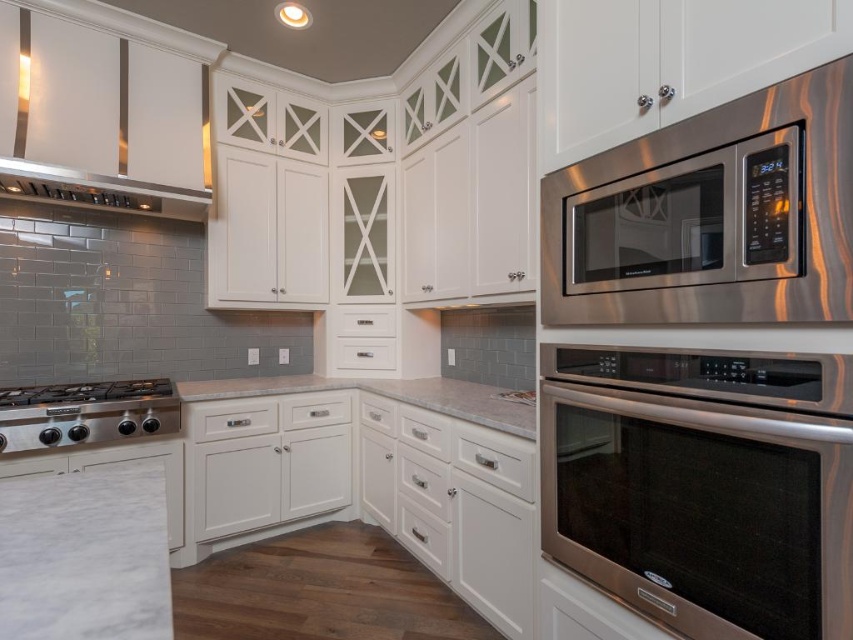
Who is shorter, stainless steel microwave at upper right or stainless steel gas stove at lower left?

Standing shorter between the two is stainless steel gas stove at lower left.

Is point (738, 106) positioned in front of point (163, 378)?

Yes, it is in front of point (163, 378).

You are a GUI agent. You are given a task and a screenshot of the screen. Output one action in this format:
    pyautogui.click(x=<x>, y=<y>)
    Task: Click on the stainless steel microwave at upper right
    The image size is (853, 640).
    Given the screenshot: What is the action you would take?
    pyautogui.click(x=711, y=216)

The height and width of the screenshot is (640, 853). What do you see at coordinates (701, 484) in the screenshot?
I see `stainless steel oven at upper right` at bounding box center [701, 484].

Who is more distant from viewer, (x=672, y=541) or (x=80, y=136)?

Positioned behind is point (x=80, y=136).

Where is `stainless steel oven at upper right`? Image resolution: width=853 pixels, height=640 pixels. stainless steel oven at upper right is located at coordinates (701, 484).

Who is positioned more to the right, stainless steel oven at upper right or stainless steel gas stove at lower left?

From the viewer's perspective, stainless steel oven at upper right appears more on the right side.

Which is behind, point (547, 522) or point (163, 385)?

The point (163, 385) is behind.

The image size is (853, 640). Identify the location of stainless steel oven at upper right. (701, 484).